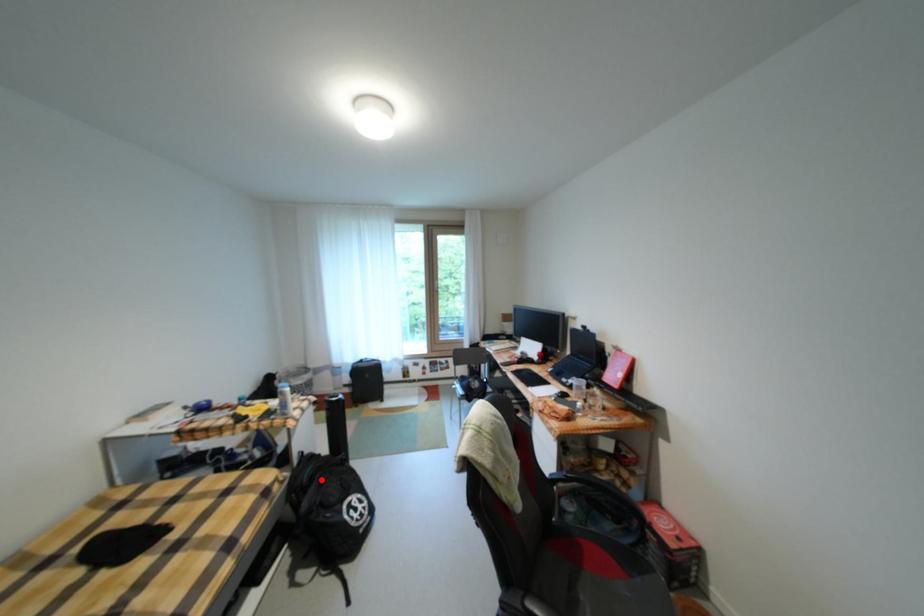
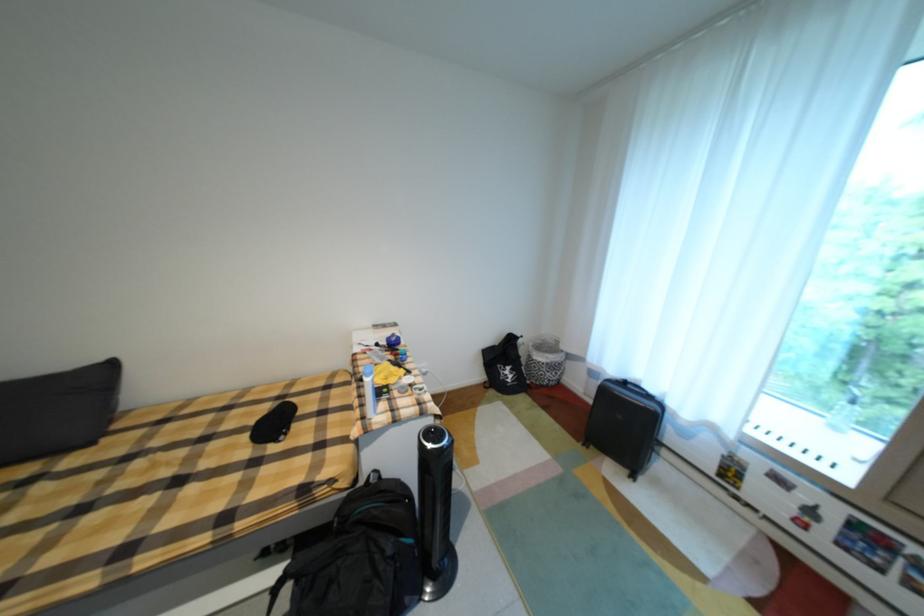
The point at the highlighted location is marked in the first image. Where is the corresponding point in the second image?

(370, 525)